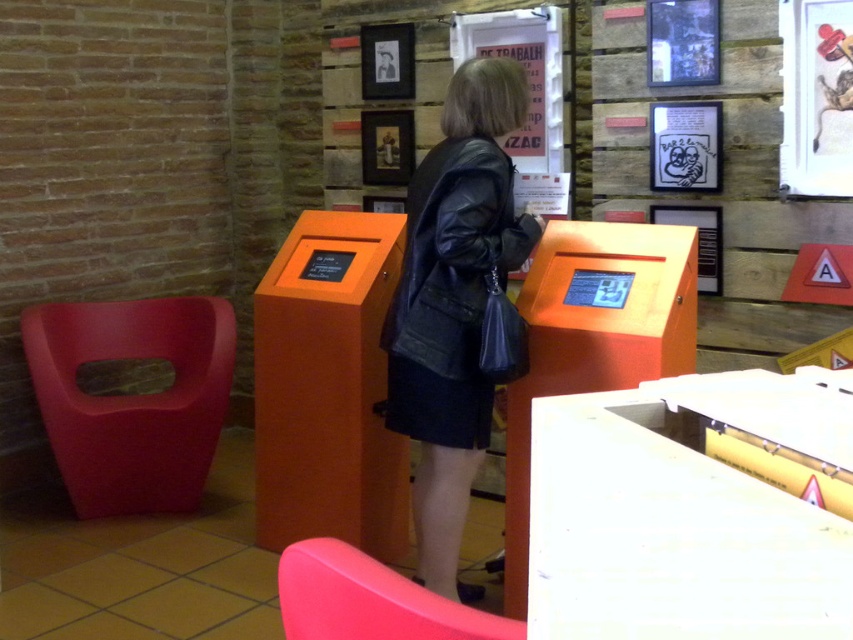
Question: Is matte plastic chair at left above matte black poster at upper center?

Choices:
 (A) yes
 (B) no

Answer: (B)

Question: Which of these objects is positioned farthest from the matte paper poster at upper center?

Choices:
 (A) white paper poster at center
 (B) matte black poster at upper center
 (C) matte plastic chair at lower left
 (D) black leather jacket at center

Answer: (C)

Question: Which object is positioned closest to the matte plastic chair at left?

Choices:
 (A) black leather jacket at center
 (B) white paper poster at center

Answer: (A)

Question: From the image, what is the correct spatial relationship of wooden framed poster at center in relation to matte black poster at upper center?

Choices:
 (A) below
 (B) above

Answer: (A)

Question: Does black leather jacket at center come behind matte black poster at upper center?

Choices:
 (A) no
 (B) yes

Answer: (A)

Question: Which point appears farthest from the camera in this image?

Choices:
 (A) (523, 161)
 (B) (474, 51)
 (C) (648, 115)
 (D) (387, 636)

Answer: (B)